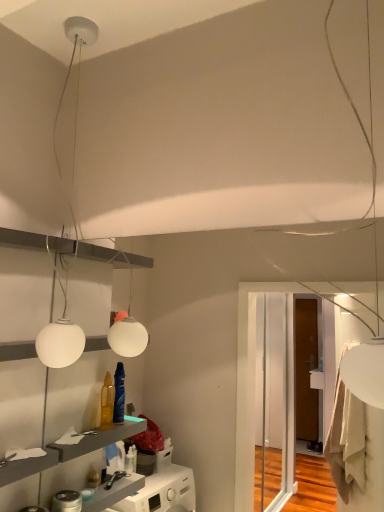
What is the approximate width of white matte globe at upper left?

4.93 inches.

The height and width of the screenshot is (512, 384). In order to click on white matte globe at upper left in this screenshot , I will do `click(60, 341)`.

This screenshot has width=384, height=512. What do you see at coordinates (60, 341) in the screenshot?
I see `white matte globe at upper left` at bounding box center [60, 341].

Identify the location of white matte globe at upper left. (60, 341).